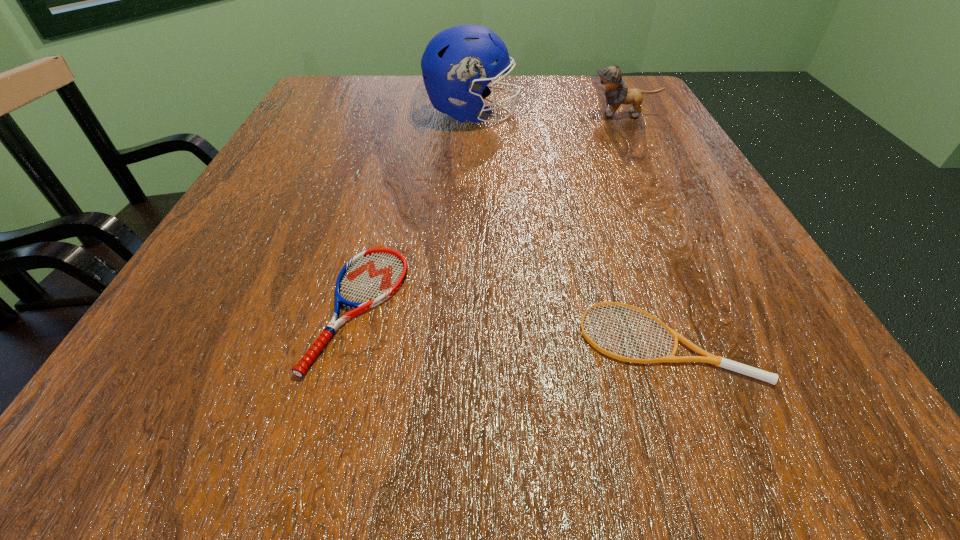
The height and width of the screenshot is (540, 960). I want to click on vacant space at the far left corner of the desktop, so click(367, 89).

In the image, there is a desktop. Where is `vacant space at the near right corner`? vacant space at the near right corner is located at coordinates (740, 411).

Identify the location of free spot between the left tennis racket and the right tennis racket. (512, 323).

This screenshot has height=540, width=960. Find the location of `unoccupied area between the right tennis racket and the kitten`. unoccupied area between the right tennis racket and the kitten is located at coordinates (643, 227).

The width and height of the screenshot is (960, 540). I want to click on free space between the right tennis racket and the third shortest object, so click(643, 227).

At what (x,y) coordinates should I click in order to perform the action: click on vacant space in between the football helmet and the left tennis racket. Please return your answer as a coordinate pair (x, y). The image size is (960, 540). Looking at the image, I should click on (416, 211).

Find the location of a particular element. Image resolution: width=960 pixels, height=540 pixels. unoccupied position between the left tennis racket and the football helmet is located at coordinates (416, 211).

At what (x,y) coordinates should I click in order to perform the action: click on empty space that is in between the kitten and the left tennis racket. Please return your answer as a coordinate pair (x, y). This screenshot has height=540, width=960. Looking at the image, I should click on (492, 211).

Image resolution: width=960 pixels, height=540 pixels. Identify the location of free space between the second tallest object and the left tennis racket. (492, 211).

The width and height of the screenshot is (960, 540). Find the location of `free space between the football helmet and the right tennis racket`. free space between the football helmet and the right tennis racket is located at coordinates (568, 227).